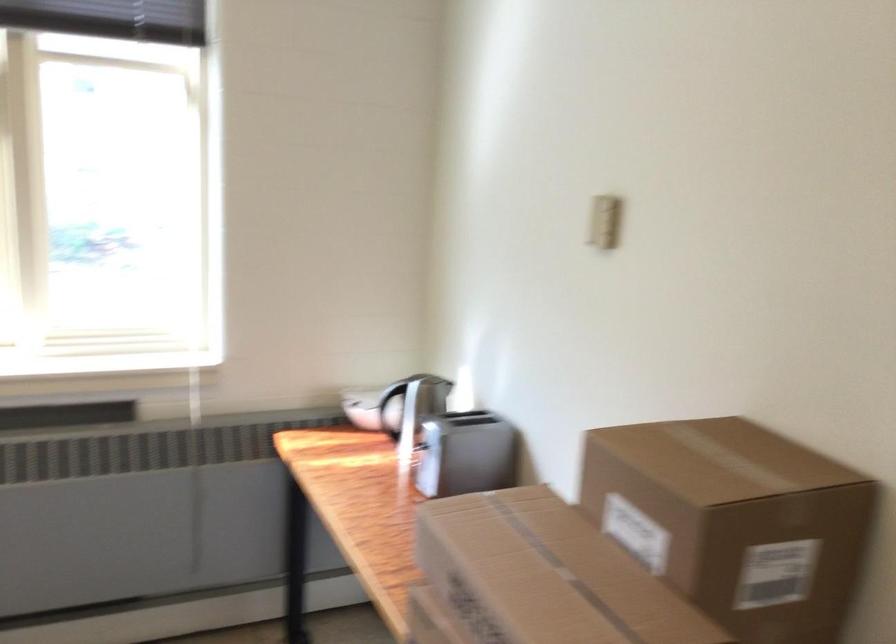
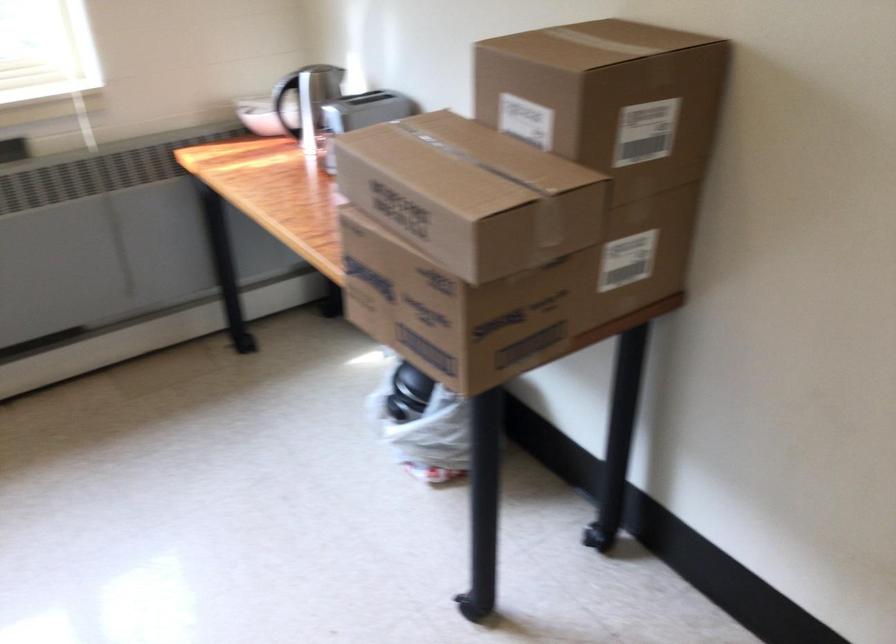
The point at [733,536] is marked in the first image. Where is the corresponding point in the second image?

(607, 98)